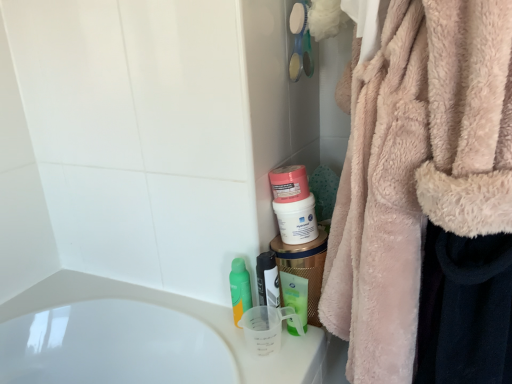
Question: Is point (246, 273) closer or farther from the camera than point (287, 297)?

Choices:
 (A) closer
 (B) farther

Answer: (B)

Question: From the image's perspective, relative to green plastic mouthwash at lower center, acting as the fourth mouthwash starting from the left, is green matte bottle at center, the 4th mouthwash in the right-to-left sequence, above or below?

Choices:
 (A) below
 (B) above

Answer: (B)

Question: Which is farther from the translucent plastic mouthwash at center, which is the 2th mouthwash from left to right?

Choices:
 (A) green matte bottle at center, the 1th mouthwash when ordered from left to right
 (B) pink matte jar at center, the 2th mouthwash viewed from the right
 (C) fuzzy pink robe at right
 (D) green plastic mouthwash at lower center, acting as the fourth mouthwash starting from the left

Answer: (C)

Question: Which object is the closest to the green plastic mouthwash at lower center, the 1th mouthwash from the right?

Choices:
 (A) pink matte jar at center, the 2th mouthwash viewed from the right
 (B) fuzzy pink robe at right
 (C) green matte bottle at center, the 4th mouthwash in the right-to-left sequence
 (D) translucent plastic mouthwash at center, which is the 3th mouthwash in right-to-left order

Answer: (D)